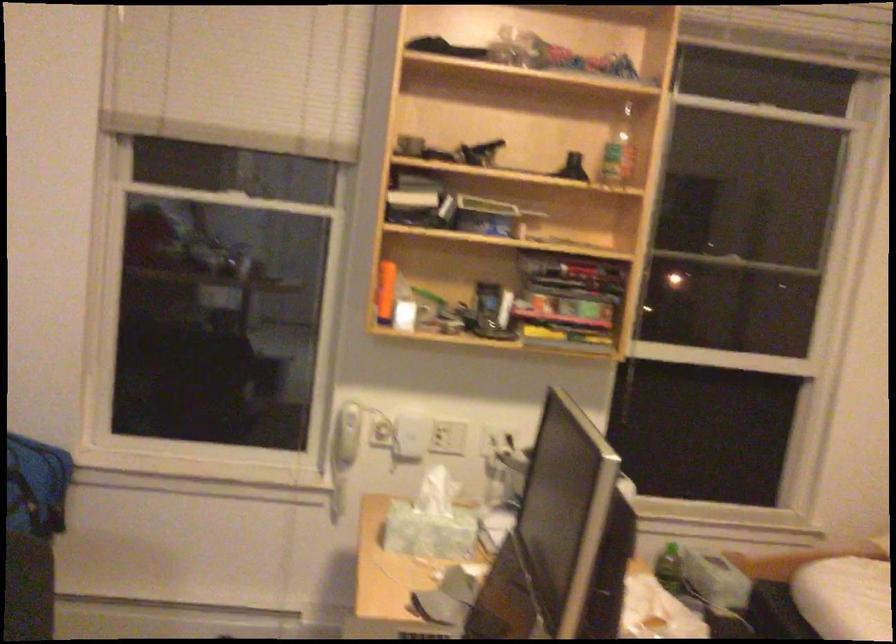
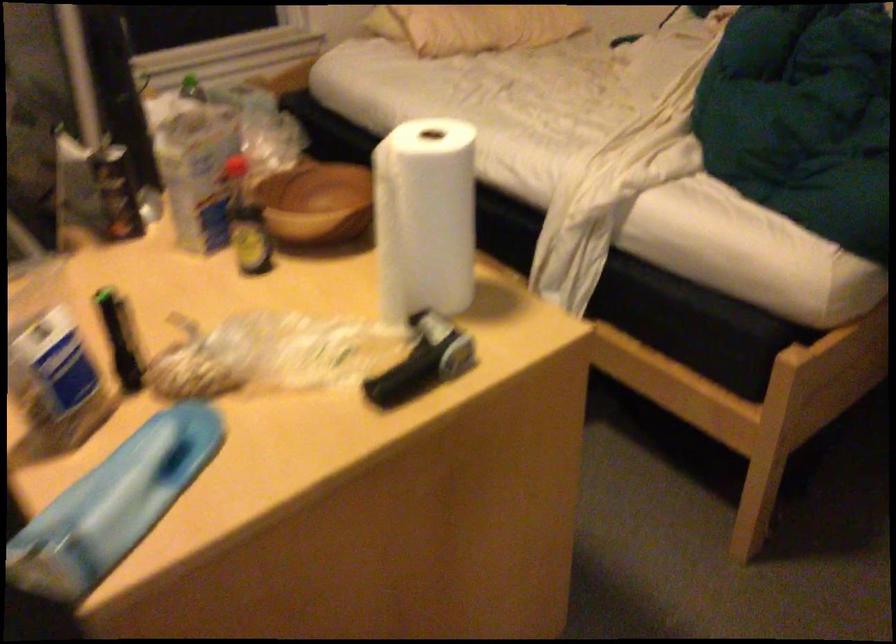
First-person continuous shooting, in which direction is the camera rotating?

The camera's rotation is toward right-down.